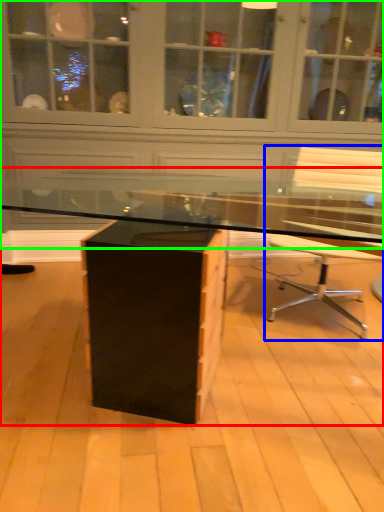
Question: Estimate the real-world distances between objects in this image. Which object is closer to desk (highlighted by a red box), chair (highlighted by a blue box) or dresser (highlighted by a green box)?

Choices:
 (A) chair
 (B) dresser

Answer: (A)